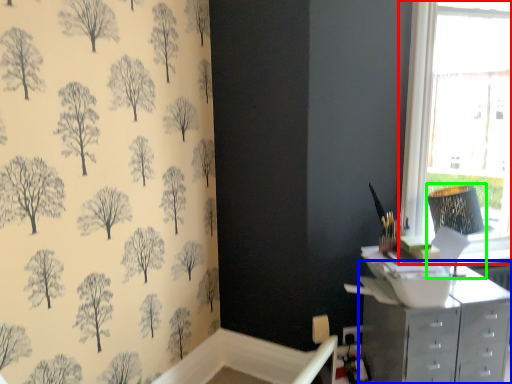
Question: Which object is positioned farthest from window (highlighted by a red box)? Select from chest of drawers (highlighted by a blue box) and lamp (highlighted by a green box).

Choices:
 (A) chest of drawers
 (B) lamp

Answer: (A)